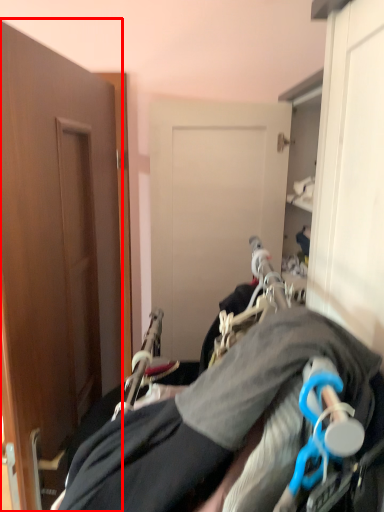
Question: From the image's perspective, where is door (annotated by the red box) located in relation to couple in the image?

Choices:
 (A) below
 (B) above

Answer: (B)